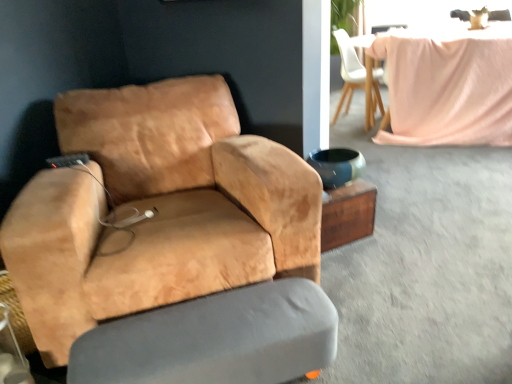
Question: Considering the relative sizes of suede tan chair at left, the 2th chair when ordered from top to bottom, and gray fabric swivel chair at lower center in the image provided, is suede tan chair at left, the 2th chair when ordered from top to bottom, bigger than gray fabric swivel chair at lower center?

Choices:
 (A) no
 (B) yes

Answer: (B)

Question: Does suede tan chair at left, the second chair positioned from the back, contain gray fabric swivel chair at lower center?

Choices:
 (A) yes
 (B) no

Answer: (B)

Question: Is suede tan chair at left, the second chair positioned from the back, positioned beyond the bounds of gray fabric swivel chair at lower center?

Choices:
 (A) no
 (B) yes

Answer: (B)

Question: From a real-world perspective, is suede tan chair at left, acting as the 1th chair starting from the left, beneath gray fabric swivel chair at lower center?

Choices:
 (A) no
 (B) yes

Answer: (A)

Question: From the image's perspective, is suede tan chair at left, the 2th chair when ordered from top to bottom, located beneath gray fabric swivel chair at lower center?

Choices:
 (A) yes
 (B) no

Answer: (B)

Question: Is point (67, 314) closer or farther from the camera than point (125, 365)?

Choices:
 (A) farther
 (B) closer

Answer: (A)

Question: In the image, is suede tan chair at left, the 2th chair when ordered from top to bottom, positioned in front of or behind gray fabric swivel chair at lower center?

Choices:
 (A) behind
 (B) front

Answer: (B)

Question: From a real-world perspective, relative to gray fabric swivel chair at lower center, is suede tan chair at left, placed as the first chair when sorted from front to back, vertically above or below?

Choices:
 (A) above
 (B) below

Answer: (A)

Question: In terms of size, does suede tan chair at left, the second chair positioned from the back, appear bigger or smaller than gray fabric swivel chair at lower center?

Choices:
 (A) small
 (B) big

Answer: (B)

Question: From the image's perspective, is white matte chair at upper center, which ranks as the 2th chair in left-to-right order, above or below wooden side table at center?

Choices:
 (A) above
 (B) below

Answer: (A)

Question: From their relative heights in the image, would you say white matte chair at upper center, which ranks as the second chair in front-to-back order, is taller or shorter than wooden side table at center?

Choices:
 (A) tall
 (B) short

Answer: (A)

Question: Is white matte chair at upper center, the 1th chair when ordered from back to front, to the left or to the right of wooden side table at center in the image?

Choices:
 (A) left
 (B) right

Answer: (B)

Question: From a real-world perspective, is white matte chair at upper center, which ranks as the second chair in front-to-back order, physically located above or below wooden side table at center?

Choices:
 (A) above
 (B) below

Answer: (A)

Question: Does point (344, 29) appear closer or farther from the camera than point (261, 360)?

Choices:
 (A) farther
 (B) closer

Answer: (A)

Question: From a real-world perspective, is white matte chair at upper center, the first chair from the right, above or below gray fabric swivel chair at lower center?

Choices:
 (A) below
 (B) above

Answer: (B)